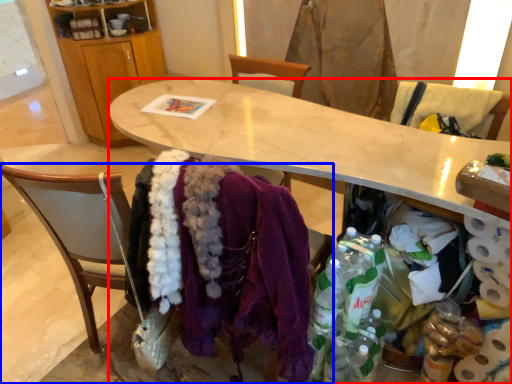
Question: Among these objects, which one is farthest to the camera, desk (highlighted by a red box) or chair (highlighted by a blue box)?

Choices:
 (A) desk
 (B) chair

Answer: (A)